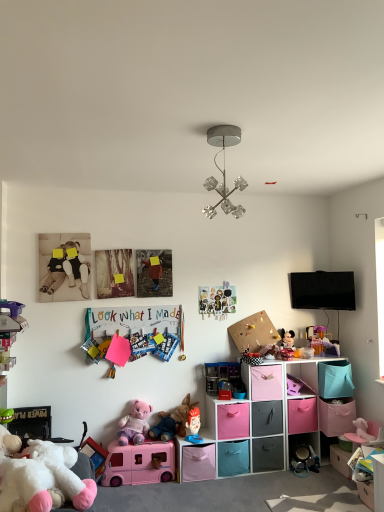
Where is `vacant region above clear glass chandelier at upper center (from a real-world perspective)`? Image resolution: width=384 pixels, height=512 pixels. vacant region above clear glass chandelier at upper center (from a real-world perspective) is located at coordinates (220, 130).